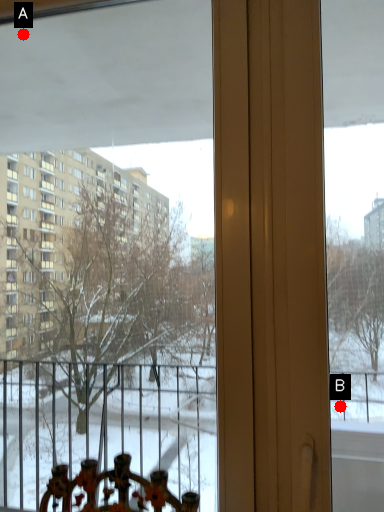
Question: Two points are circled on the image, labeled by A and B beside each circle. Which point is closer to the camera taking this photo?

Choices:
 (A) A is closer
 (B) B is closer

Answer: (A)